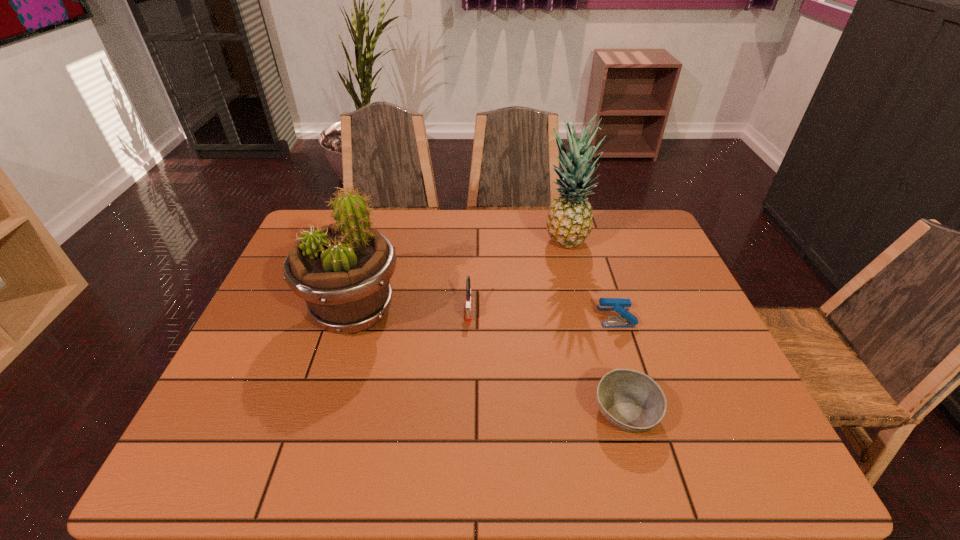
The height and width of the screenshot is (540, 960). Identify the location of vacant space at the far right corner. (612, 217).

At what (x,y) coordinates should I click in order to perform the action: click on free location at the near right corner. Please return your answer as a coordinate pair (x, y). This screenshot has height=540, width=960. Looking at the image, I should click on (719, 466).

This screenshot has height=540, width=960. I want to click on free point between the flowerpot and the fourth object from right to left, so click(x=411, y=309).

At what (x,y) coordinates should I click in order to perform the action: click on vacant area between the shorter stapler and the fourth object from right to left. Please return your answer as a coordinate pair (x, y). The height and width of the screenshot is (540, 960). Looking at the image, I should click on (542, 312).

Identify the location of free spot between the pineapple and the right stapler. (590, 280).

Where is `vacant space in between the shortest object and the leftmost object`? The height and width of the screenshot is (540, 960). vacant space in between the shortest object and the leftmost object is located at coordinates (490, 361).

At what (x,y) coordinates should I click in order to perform the action: click on vacant area between the pineapple and the leftmost object. Please return your answer as a coordinate pair (x, y). The image size is (960, 540). Looking at the image, I should click on (459, 277).

Find the location of a particular element. This screenshot has width=960, height=540. free point between the fourth tallest object and the farthest object is located at coordinates (590, 280).

Find the location of a particular element. This screenshot has height=540, width=960. free area in between the shortest object and the farthest object is located at coordinates (595, 328).

This screenshot has height=540, width=960. Find the location of `vacant space in between the taller stapler and the farthest object`. vacant space in between the taller stapler and the farthest object is located at coordinates (516, 275).